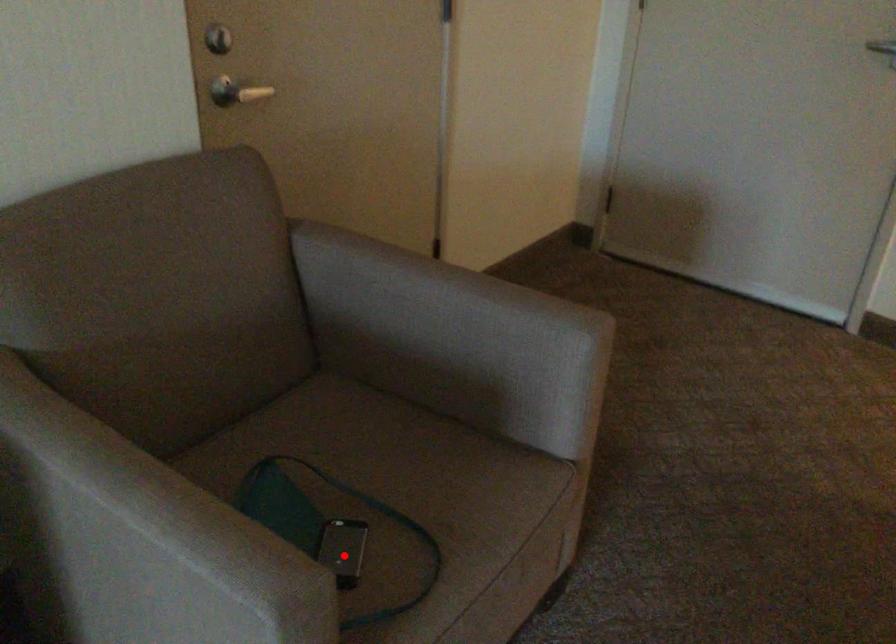
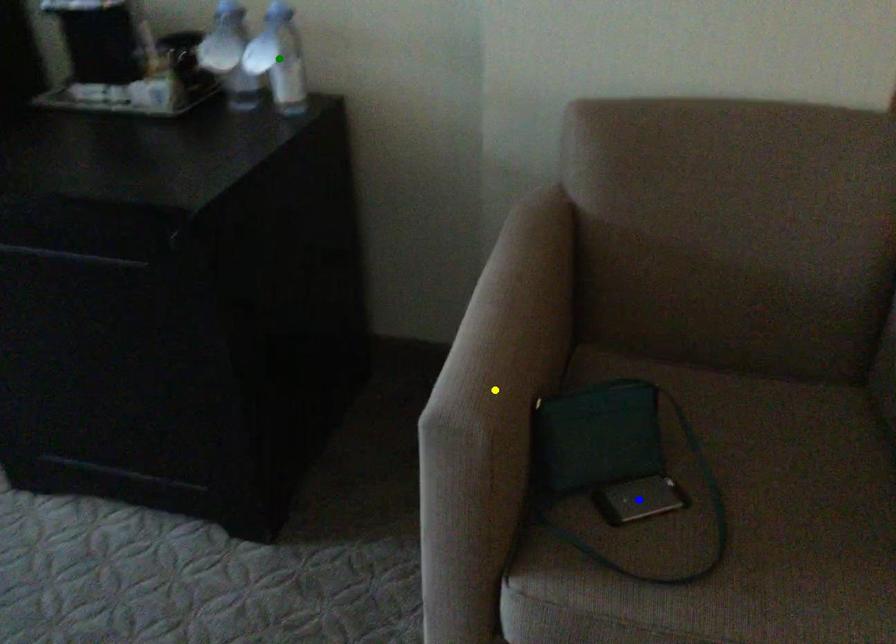
Question: I am providing you with two images of the same scene from different viewpoints. A red point is marked on the first image. You are given multiple points on the second image. In image 2, which mark is for the same physical point as the one in image 1?

Choices:
 (A) blue point
 (B) green point
 (C) yellow point

Answer: (A)